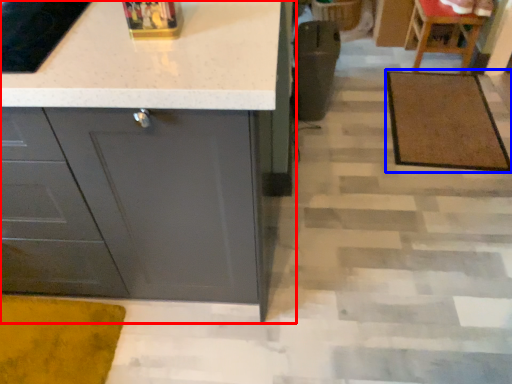
Question: Which of the following is the closest to the observer, cabinetry (highlighted by a red box) or doormat (highlighted by a blue box)?

Choices:
 (A) cabinetry
 (B) doormat

Answer: (A)